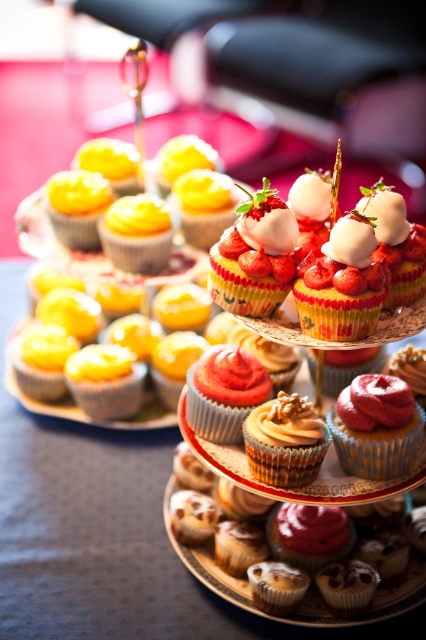
Question: Which point appears farthest from the camera in this image?

Choices:
 (A) (262, 456)
 (B) (351, 620)

Answer: (B)

Question: Considering the relative positions of smooth pink frosting cupcake at center and caramelized walnut cupcake at center in the image provided, where is smooth pink frosting cupcake at center located with respect to caramelized walnut cupcake at center?

Choices:
 (A) above
 (B) below

Answer: (A)

Question: Is smooth pink frosting cupcake at center to the right of smooth red frosting cupcake at center from the viewer's perspective?

Choices:
 (A) yes
 (B) no

Answer: (A)

Question: Is caramelized walnut cupcake at center above glazed brown muffin at center?

Choices:
 (A) yes
 (B) no

Answer: (A)

Question: Which of these objects is positioned closest to the caramelized walnut cupcake at center?

Choices:
 (A) glazed brown muffin at center
 (B) smooth red frosting cupcake at center
 (C) yellow matte cupcake at upper left
 (D) smooth pink frosting cupcake at center

Answer: (D)

Question: Among these points, which one is farthest from the camera?

Choices:
 (A) (x=411, y=458)
 (B) (x=322, y=440)
 (C) (x=371, y=612)
 (D) (x=230, y=385)

Answer: (D)